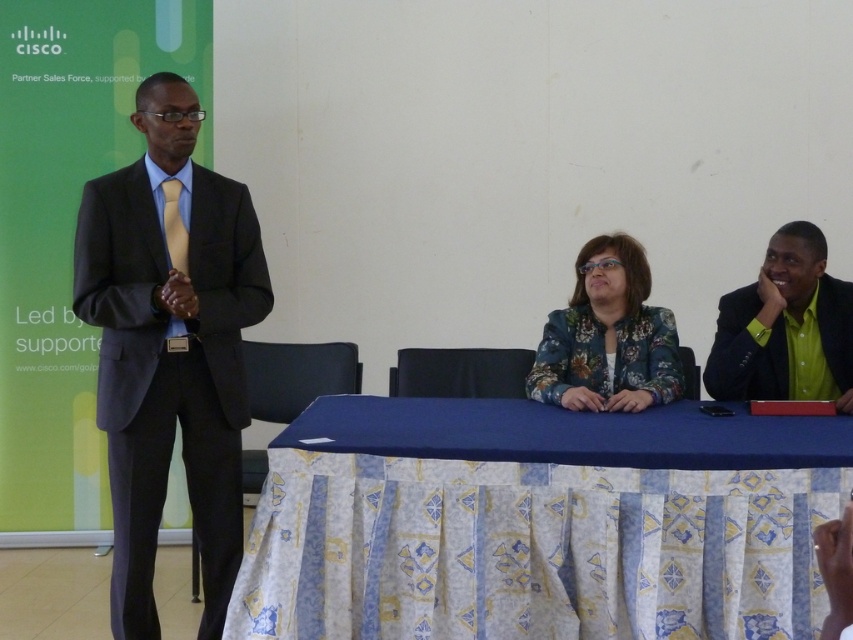
Is blue fabric table at center closer to camera compared to matte black suit at left?

Yes, it is in front of matte black suit at left.

Looking at this image, who is taller, blue fabric table at center or matte black suit at left?

Standing taller between the two is matte black suit at left.

Locate an element on the screen. Image resolution: width=853 pixels, height=640 pixels. blue fabric table at center is located at coordinates (538, 522).

From the picture: Can you confirm if blue fabric table at center is smaller than floral fabric jacket at center?

No.

In the scene shown: Can you confirm if blue fabric table at center is taller than floral fabric jacket at center?

No.

The image size is (853, 640). What do you see at coordinates (538, 522) in the screenshot?
I see `blue fabric table at center` at bounding box center [538, 522].

Image resolution: width=853 pixels, height=640 pixels. Identify the location of blue fabric table at center. click(x=538, y=522).

Can you confirm if floral fabric jacket at center is taller than yellow satin tie at left?

Indeed, floral fabric jacket at center has a greater height compared to yellow satin tie at left.

Is point (608, 246) closer to camera compared to point (172, 241)?

No.

The width and height of the screenshot is (853, 640). Find the location of `floral fabric jacket at center`. floral fabric jacket at center is located at coordinates (607, 337).

The width and height of the screenshot is (853, 640). I want to click on floral fabric jacket at center, so click(607, 337).